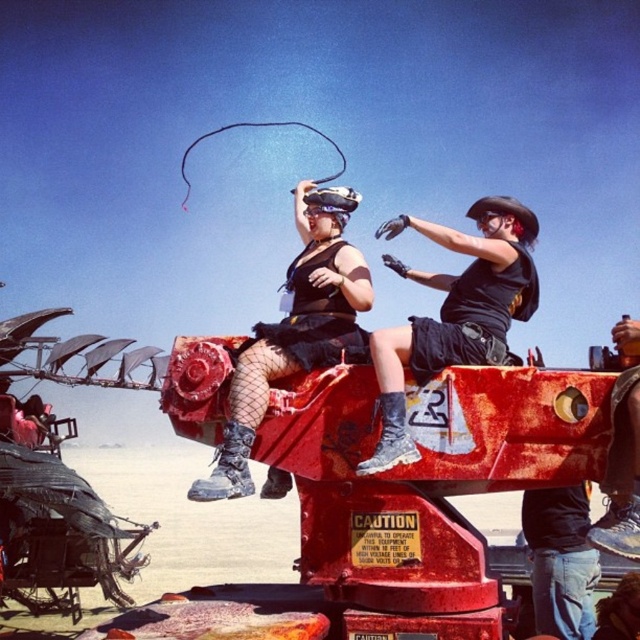
Can you confirm if black matte helmet at upper right is thinner than jeans at lower right?

No.

Does point (404, 216) come in front of point (540, 579)?

Yes, point (404, 216) is in front of point (540, 579).

Does point (440, 365) lie behind point (556, 536)?

No, it is in front of (556, 536).

Locate an element on the screen. black matte helmet at upper right is located at coordinates (452, 312).

Looking at this image, does matte black helmet at center appear on the left side of jeans at lower right?

Yes, matte black helmet at center is to the left of jeans at lower right.

Does matte black helmet at center appear on the right side of jeans at lower right?

No, matte black helmet at center is not to the right of jeans at lower right.

Does point (250, 401) lie behind point (556, 611)?

That is False.

The height and width of the screenshot is (640, 640). In order to click on matte black helmet at center in this screenshot , I will do `click(296, 330)`.

You are a GUI agent. You are given a task and a screenshot of the screen. Output one action in this format:
    pyautogui.click(x=<x>, y=<y>)
    Task: Click on the black matte helmet at upper right
    
    Given the screenshot: What is the action you would take?
    pyautogui.click(x=452, y=312)

Is point (420, 332) closer to camera compared to point (349, 337)?

Yes.

Find the location of a particular element. The width and height of the screenshot is (640, 640). black matte helmet at upper right is located at coordinates (452, 312).

This screenshot has height=640, width=640. What are the coordinates of `black matte helmet at upper right` in the screenshot? It's located at (452, 312).